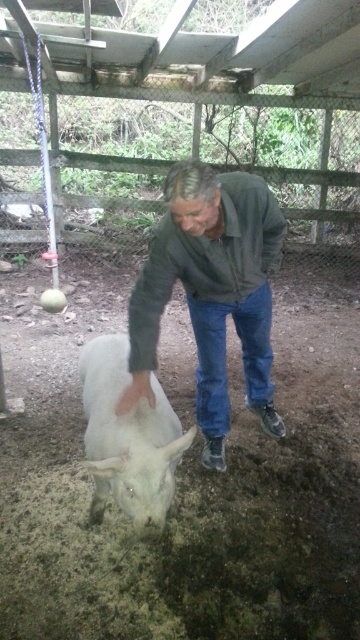
Question: Does green matte shirt at center appear over white woolly goat at lower left?

Choices:
 (A) yes
 (B) no

Answer: (A)

Question: Does green matte shirt at center have a greater width compared to white woolly goat at lower left?

Choices:
 (A) no
 (B) yes

Answer: (B)

Question: Among these points, which one is farthest from the camera?

Choices:
 (A) (259, 230)
 (B) (191, 432)

Answer: (A)

Question: Which object appears farthest from the camera in this image?

Choices:
 (A) green matte shirt at center
 (B) white woolly goat at lower left

Answer: (A)

Question: Is green matte shirt at center closer to the viewer compared to white woolly goat at lower left?

Choices:
 (A) yes
 (B) no

Answer: (B)

Question: Which of the following is the farthest from the observer?

Choices:
 (A) (251, 266)
 (B) (99, 451)

Answer: (A)